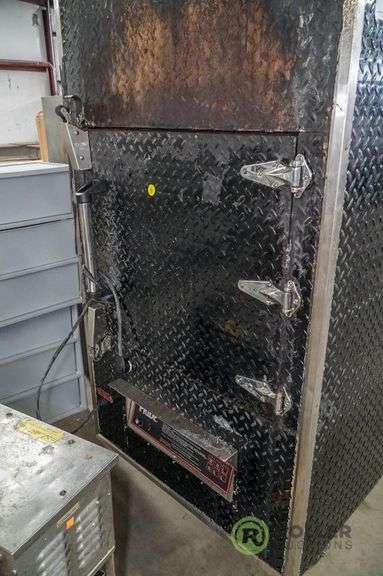
What are the coordinates of `hinge` in the screenshot? It's located at (283, 401), (296, 302), (304, 179).